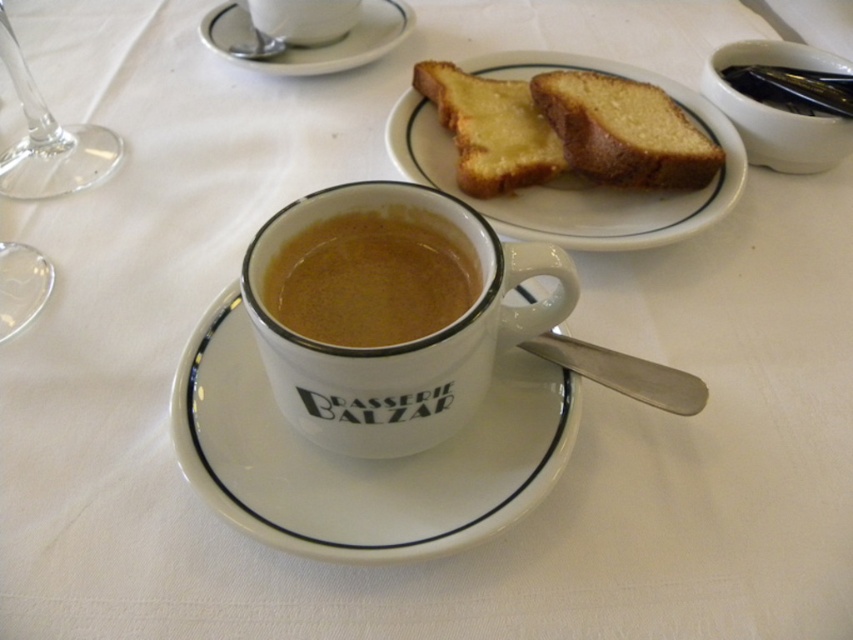
You are a customer at a cafe and you see two cups on the table. The brown matte cup at center and the white ceramic cup at center. Which cup is closer to you?

The brown matte cup at center is closer to you because it is in front of the white ceramic cup at center.